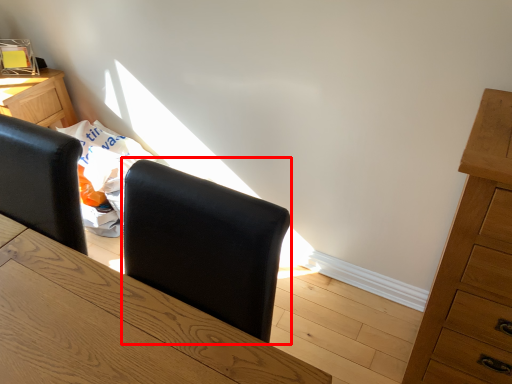
Question: From the image's perspective, what is the correct spatial positioning of armchair (annotated by the red box) in reference to chest of drawers?

Choices:
 (A) above
 (B) below

Answer: (B)